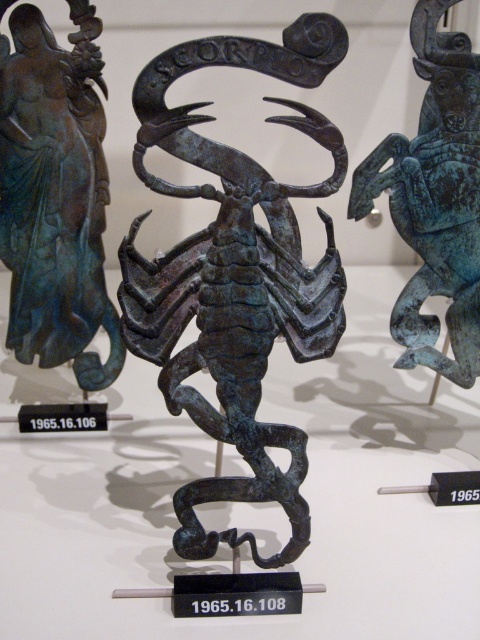
Who is higher up, bronze scorpion at center or bronze statue at left?

bronze statue at left is above.

Which is behind, point (240, 314) or point (48, 161)?

The point (48, 161) is more distant.

You are a GUI agent. You are given a task and a screenshot of the screen. Output one action in this format:
    pyautogui.click(x=<x>, y=<y>)
    Task: Click on the bronze scorpion at center
    
    Given the screenshot: What is the action you would take?
    pyautogui.click(x=236, y=275)

Consider the image. Which of these two, bronze statue at left or green patina metal scorpion at center, stands shorter?

green patina metal scorpion at center

Does bronze statue at left have a greater height compared to green patina metal scorpion at center?

Correct, bronze statue at left is much taller as green patina metal scorpion at center.

This screenshot has width=480, height=640. In order to click on bronze statue at left in this screenshot , I will do `click(55, 195)`.

In the scene shown: Is bronze scorpion at center thinner than green patina metal scorpion at center?

No.

Is bronze scorpion at center to the left of green patina metal scorpion at center from the viewer's perspective?

Indeed, bronze scorpion at center is positioned on the left side of green patina metal scorpion at center.

At what (x,y) coordinates should I click in order to perform the action: click on bronze scorpion at center. Please return your answer as a coordinate pair (x, y). The image size is (480, 640). Looking at the image, I should click on (236, 275).